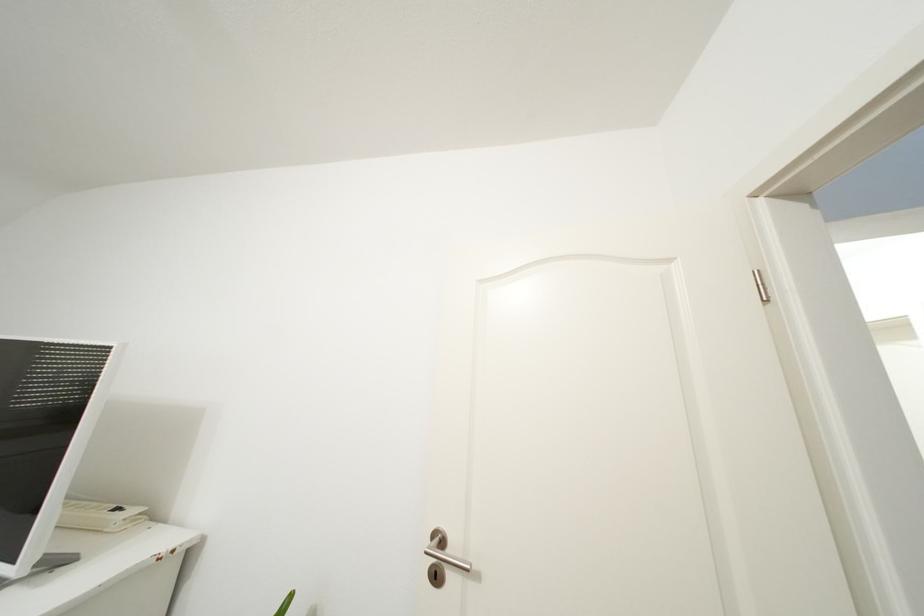
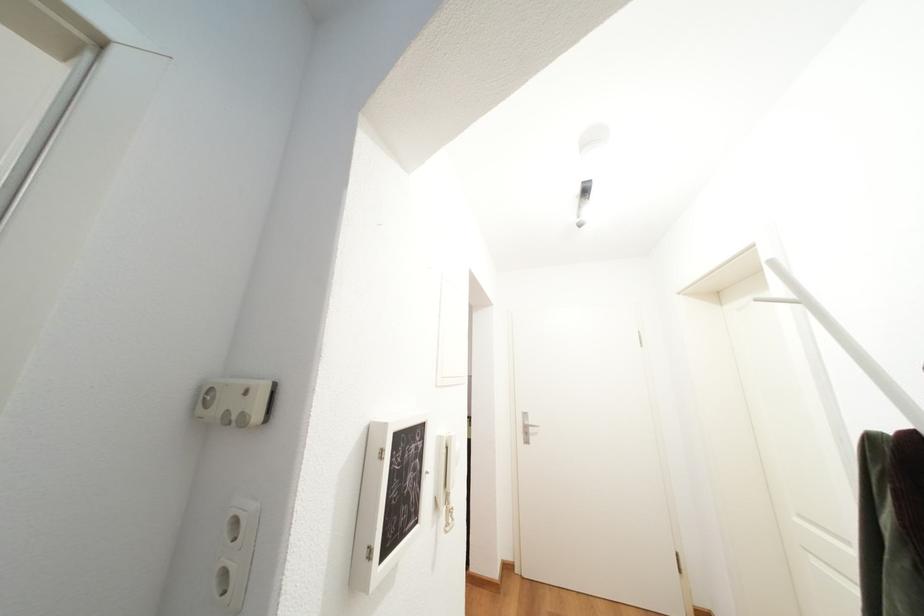
Question: Which direction would the cameraman need to move to produce the second image? Reply with the corresponding letter.

Choices:
 (A) Left
 (B) Right
 (C) Forward
 (D) Backward

Answer: (B)